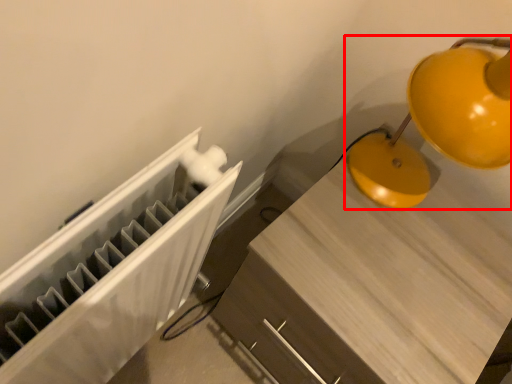
Question: Where is lamp (annotated by the red box) located in relation to furniture in the image?

Choices:
 (A) left
 (B) right

Answer: (B)